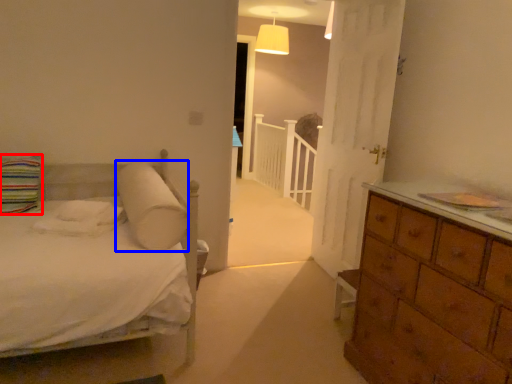
Question: Which object is further to the camera taking this photo, pillow (highlighted by a red box) or pillow (highlighted by a blue box)?

Choices:
 (A) pillow
 (B) pillow

Answer: (A)